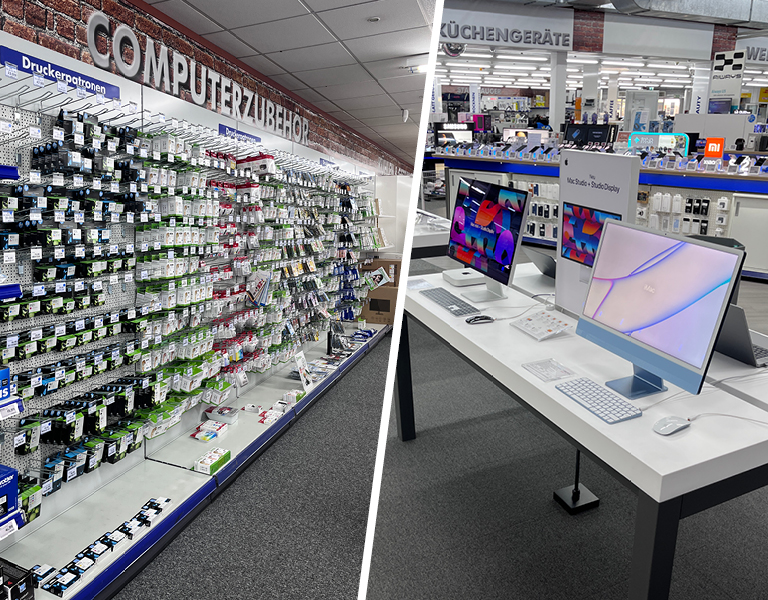
Identify the location of monitor. (603, 316).